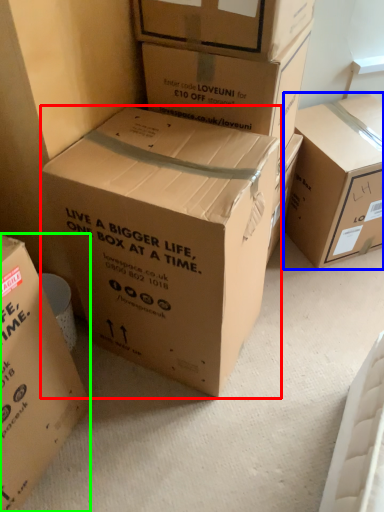
Question: Considering the real-world distances, which object is closest to box (highlighted by a red box)? box (highlighted by a blue box) or box (highlighted by a green box).

Choices:
 (A) box
 (B) box

Answer: (B)